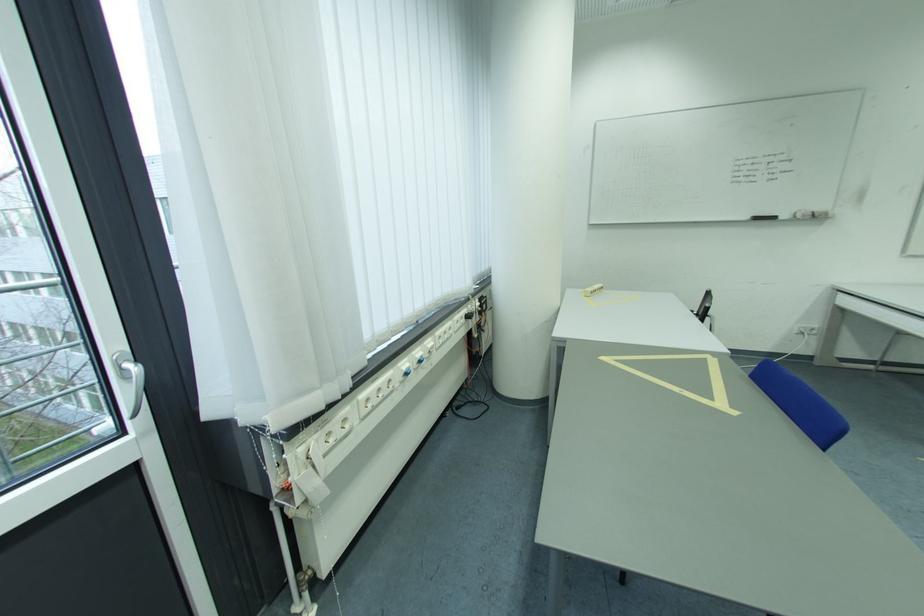
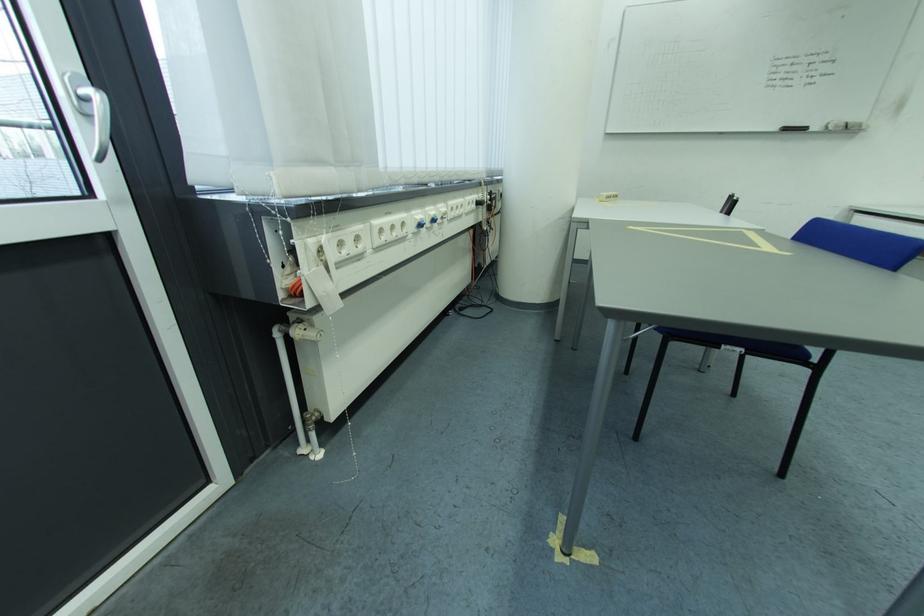
Locate, in the second image, the point that corresponds to the point at 453,326 in the first image.

(465, 200)